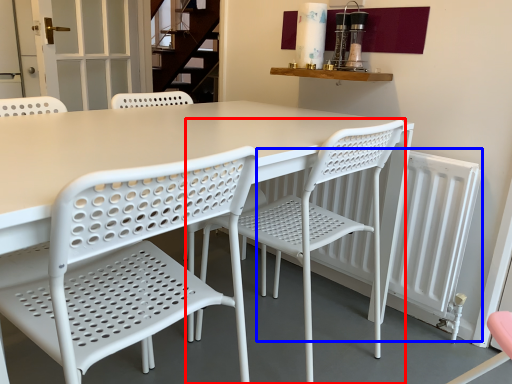
Question: Which object appears farthest to the camera in this image, chair (highlighted by a red box) or radiator (highlighted by a blue box)?

Choices:
 (A) chair
 (B) radiator

Answer: (B)